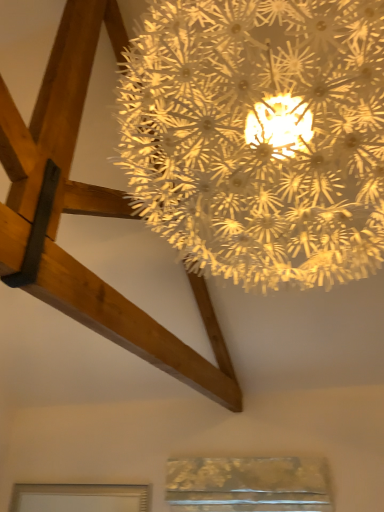
Question: Based on their sizes in the image, would you say matte silver frame at lower left, the first window in the left-to-right sequence, is bigger or smaller than illuminated paper-like at upper center?

Choices:
 (A) small
 (B) big

Answer: (A)

Question: From the image's perspective, is matte silver frame at lower left, the first window in the left-to-right sequence, positioned above or below illuminated paper-like at upper center?

Choices:
 (A) below
 (B) above

Answer: (A)

Question: Estimate the real-world distances between objects in this image. Which object is farther from the matte silver frame at lower left, the first window in the left-to-right sequence?

Choices:
 (A) illuminated paper-like at upper center
 (B) metallic gold window at lower center, placed as the 1th window when sorted from right to left

Answer: (A)

Question: Estimate the real-world distances between objects in this image. Which object is farther from the metallic gold window at lower center, acting as the second window starting from the left?

Choices:
 (A) illuminated paper-like at upper center
 (B) matte silver frame at lower left, the first window in the left-to-right sequence

Answer: (A)